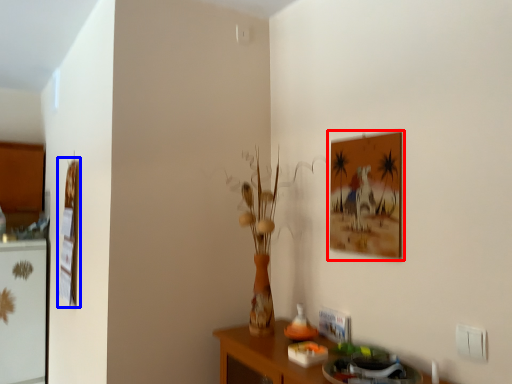
Question: Among these objects, which one is nearest to the camera, picture frame (highlighted by a red box) or picture frame (highlighted by a blue box)?

Choices:
 (A) picture frame
 (B) picture frame

Answer: (A)